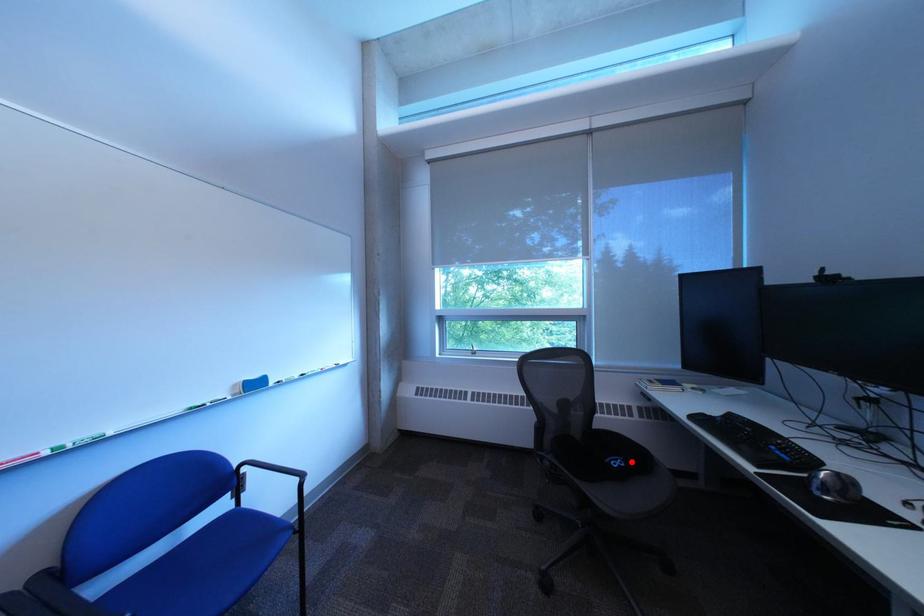
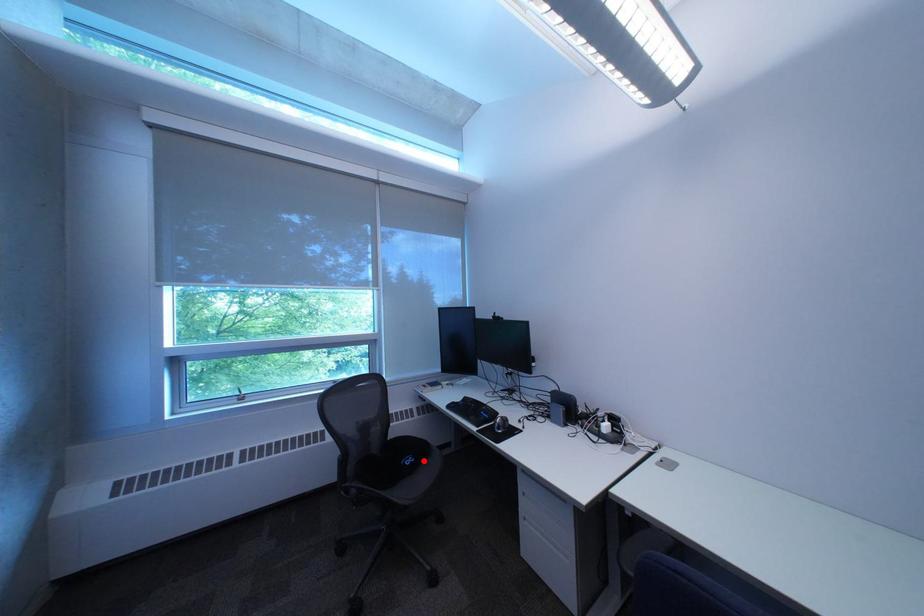
I am providing you with two images of the same scene from different viewpoints. A red point is marked on the first image and another point is marked on the second image. Do the highlighted points in image1 and image2 indicate the same real-world spot?

Yes